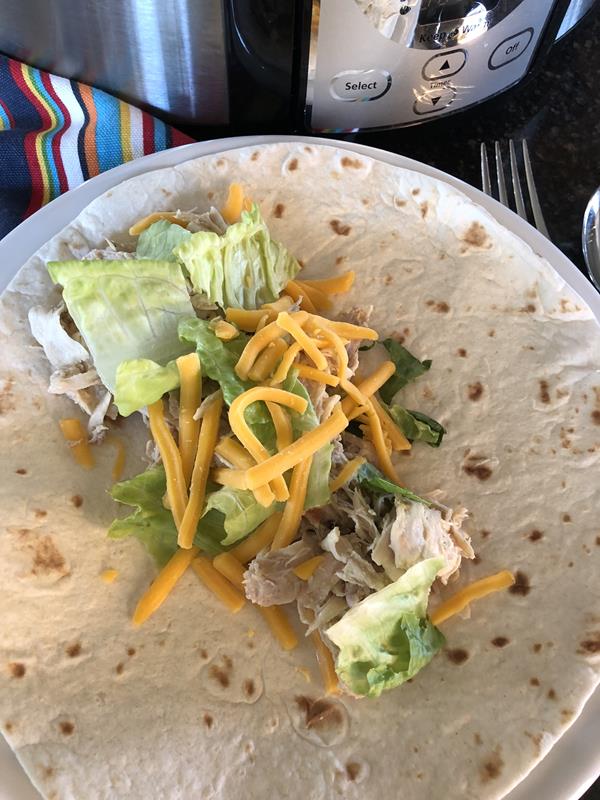
Where is `buttons on instant pot`? buttons on instant pot is located at coordinates (355, 86), (447, 58), (440, 97), (509, 53).